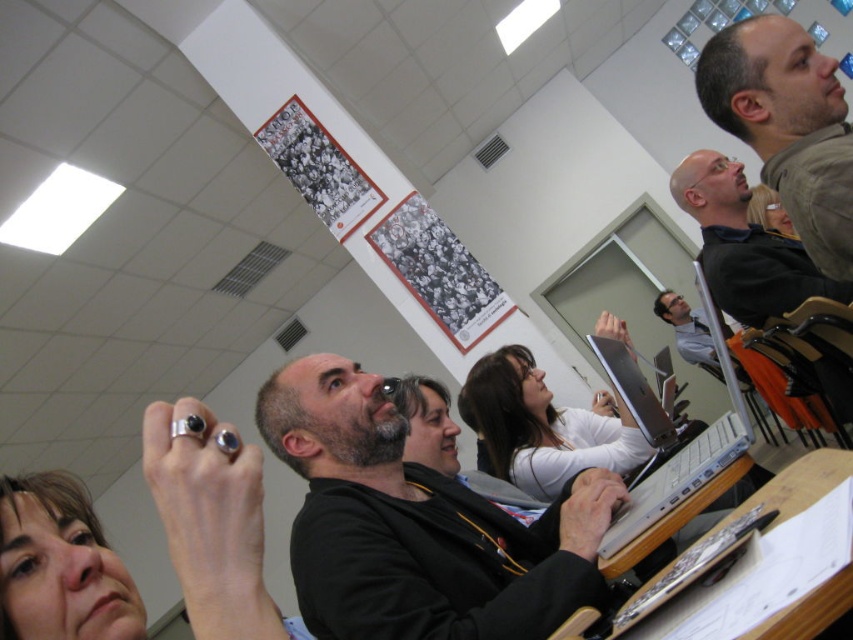
Question: Which point appears closest to the camera in this image?

Choices:
 (A) (218, 496)
 (B) (775, 298)
 (C) (699, 70)
 (D) (699, 324)

Answer: (A)

Question: Which point appears farthest from the camera in this image?

Choices:
 (A) (815, 289)
 (B) (706, 330)

Answer: (B)

Question: Is silver metallic ring at upper left above bald man at upper right?

Choices:
 (A) yes
 (B) no

Answer: (B)

Question: Can you confirm if silver metallic ring at upper left is wider than matte black laptop at upper right?

Choices:
 (A) yes
 (B) no

Answer: (A)

Question: Observing the image, what is the correct spatial positioning of black matte shirt at center in reference to silver metallic ring at upper left?

Choices:
 (A) below
 (B) above

Answer: (A)

Question: Which point is closer to the camera?

Choices:
 (A) [x=695, y=339]
 (B) [x=527, y=444]
 (C) [x=294, y=449]
 (D) [x=234, y=616]

Answer: (D)